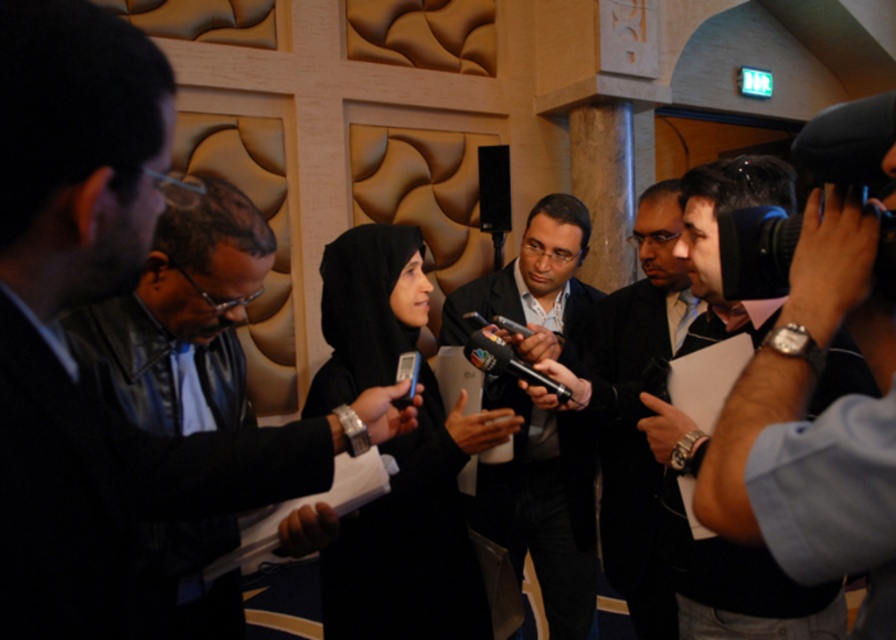
You are standing in the conference room and want to reach the point at coordinates (56,184). If you can reach objects within 24 inches, can you reach it?

The point at coordinates (56,184) is 22.09 inches away from the viewer, which is within the 24 inch reach limit. Yes, you can reach it.

You are a photographer at the event and need to place the black leather jacket at left and the black leather camera at right on a shelf. Which object should you place first if you want to arrange them from smallest to largest?

The black leather jacket at left should be placed first because it is smaller than the black leather camera at right.

You are a photographer positioned to the right of the scene. You need to capture a photo that includes both the black leather jacket at left and the dark suit at center. Which object should you adjust your position to focus on first to ensure both are in frame?

The black leather jacket at left is to the left of dark suit at center. To include both in the photo, you should focus on the black leather jacket at left first since it is positioned further to the left and ensure the dark suit at center is also within the frame.